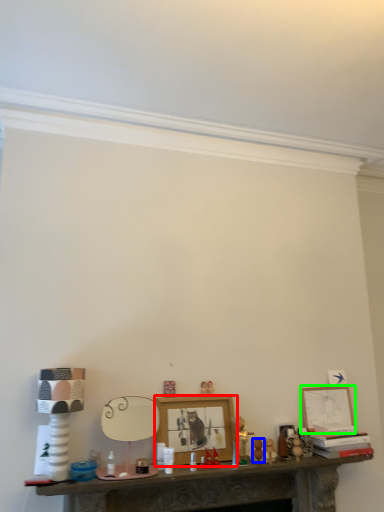
Question: Which object is positioned farthest from picture frame (highlighted by a red box)? Select from toy (highlighted by a blue box) and picture frame (highlighted by a green box).

Choices:
 (A) toy
 (B) picture frame

Answer: (B)